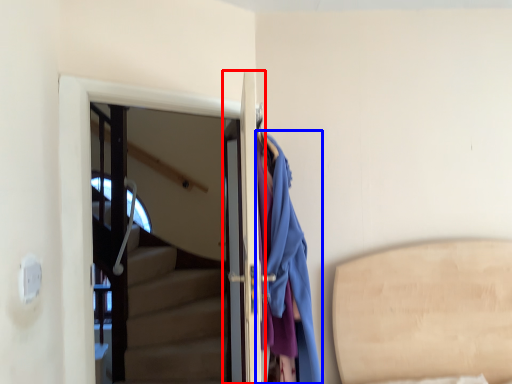
Question: Which object appears farthest to the camera in this image, door (highlighted by a red box) or clothing (highlighted by a blue box)?

Choices:
 (A) door
 (B) clothing

Answer: (A)